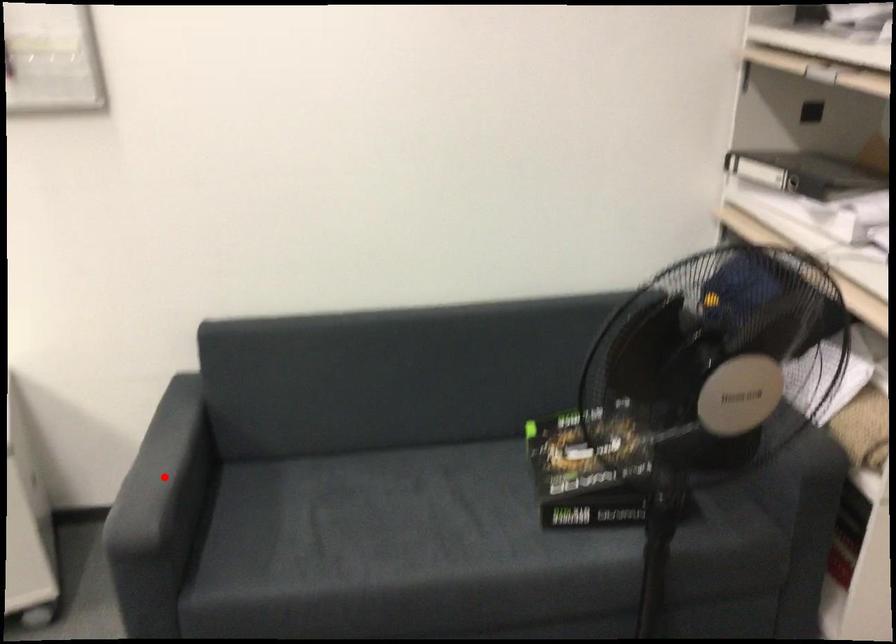
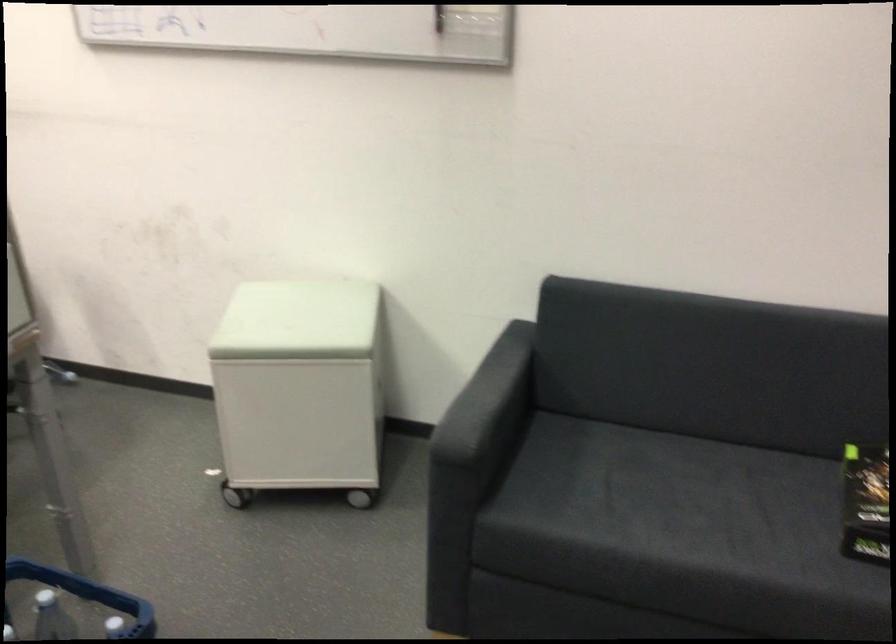
Question: I am providing you with two images of the same scene from different viewpoints. Given a red point in image1, look at the same physical point in image2. Is it:

Choices:
 (A) Closer to the viewpoint
 (B) Farther from the viewpoint

Answer: (B)